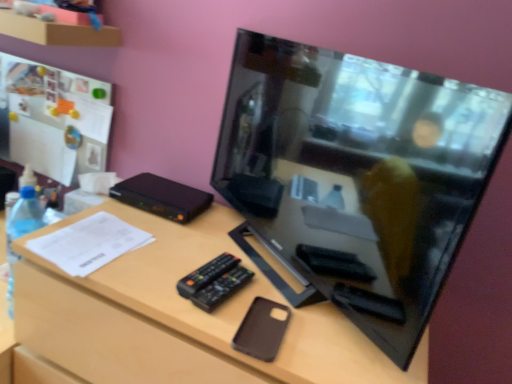
Locate an element on the screen. spots to the right of black plastic remote at center is located at coordinates (303, 316).